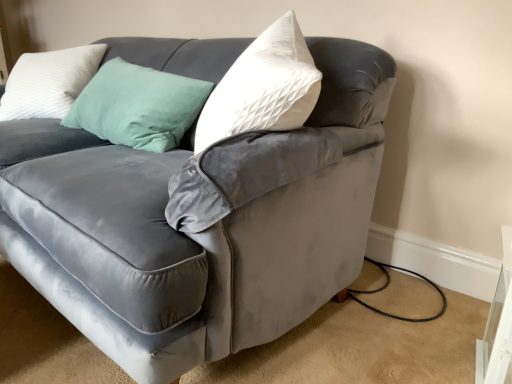
This screenshot has height=384, width=512. What do you see at coordinates (49, 82) in the screenshot?
I see `white quilted pillow at upper left` at bounding box center [49, 82].

Identify the location of white quilted pillow at upper left. (49, 82).

You are a GUI agent. You are given a task and a screenshot of the screen. Output one action in this format:
    pyautogui.click(x=<x>, y=<y>)
    Task: Click on the white quilted pillow at upper left
    This screenshot has width=512, height=384.
    Given the screenshot: What is the action you would take?
    pos(49,82)